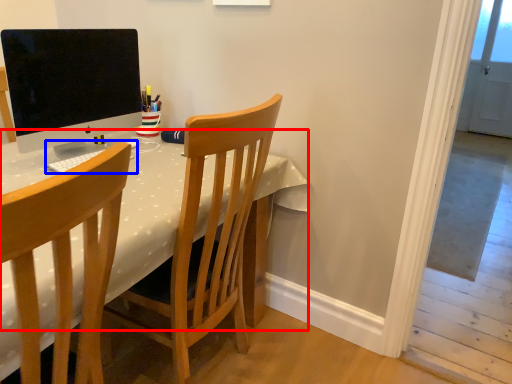
Question: Which point is closer to the camera, table (highlighted by a red box) or computer keyboard (highlighted by a blue box)?

Choices:
 (A) table
 (B) computer keyboard

Answer: (A)